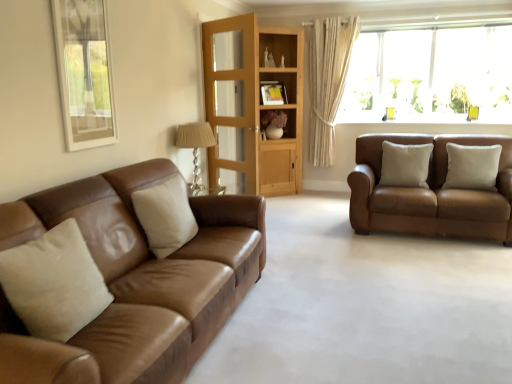
Question: Is beige fabric pillow at left, the 1th pillow when ordered from left to right, in front of beige leather pillow at left, the second pillow in the left-to-right sequence?

Choices:
 (A) no
 (B) yes

Answer: (B)

Question: Is beige fabric pillow at left, the 4th pillow from the back, placed right next to beige leather pillow at left, the 2th pillow when ordered from front to back?

Choices:
 (A) no
 (B) yes

Answer: (A)

Question: From a real-world perspective, is beige fabric pillow at left, which ranks as the 4th pillow in right-to-left order, on top of beige leather pillow at left, the second pillow in the left-to-right sequence?

Choices:
 (A) no
 (B) yes

Answer: (B)

Question: Considering the relative sizes of beige fabric pillow at left, which is the 1th pillow in front-to-back order, and beige leather pillow at left, the second pillow in the left-to-right sequence, in the image provided, is beige fabric pillow at left, which is the 1th pillow in front-to-back order, taller than beige leather pillow at left, the second pillow in the left-to-right sequence,?

Choices:
 (A) no
 (B) yes

Answer: (B)

Question: Does beige fabric pillow at left, the 4th pillow from the back, lie behind beige leather pillow at left, the 2th pillow when ordered from front to back?

Choices:
 (A) yes
 (B) no

Answer: (B)

Question: From the image's perspective, is brown leather couch at right, which is the 1th studio couch in back-to-front order, positioned above or below beige leather pillow at right, which appears as the 2th pillow when viewed from the back?

Choices:
 (A) above
 (B) below

Answer: (B)

Question: Is brown leather couch at right, the first studio couch in the right-to-left sequence, situated inside beige leather pillow at right, which ranks as the third pillow in front-to-back order, or outside?

Choices:
 (A) inside
 (B) outside

Answer: (B)

Question: Looking at their shapes, would you say brown leather couch at right, arranged as the second studio couch when viewed from the left, is wider or thinner than beige leather pillow at right, which ranks as the first pillow in right-to-left order?

Choices:
 (A) thin
 (B) wide

Answer: (B)

Question: Considering their positions, is brown leather couch at right, arranged as the second studio couch when viewed from the left, located in front of or behind beige leather pillow at right, which ranks as the third pillow in front-to-back order?

Choices:
 (A) front
 (B) behind

Answer: (A)

Question: Is beige fabric pillow at left, the 4th pillow from the back, wider or thinner than translucent glass window at upper right?

Choices:
 (A) wide
 (B) thin

Answer: (B)

Question: From their relative heights in the image, would you say beige fabric pillow at left, which ranks as the 4th pillow in right-to-left order, is taller or shorter than translucent glass window at upper right?

Choices:
 (A) short
 (B) tall

Answer: (A)

Question: Considering the positions of beige fabric pillow at left, which ranks as the 4th pillow in right-to-left order, and translucent glass window at upper right in the image, is beige fabric pillow at left, which ranks as the 4th pillow in right-to-left order, bigger or smaller than translucent glass window at upper right?

Choices:
 (A) small
 (B) big

Answer: (A)

Question: Considering the positions of point (26, 244) and point (463, 112), is point (26, 244) closer or farther from the camera than point (463, 112)?

Choices:
 (A) farther
 (B) closer

Answer: (B)

Question: Is brown leather couch at right, marked as the 2th studio couch in a front-to-back arrangement, to the left or to the right of light wood cabinet at center in the image?

Choices:
 (A) left
 (B) right

Answer: (B)

Question: Is brown leather couch at right, marked as the 2th studio couch in a front-to-back arrangement, taller or shorter than light wood cabinet at center?

Choices:
 (A) tall
 (B) short

Answer: (B)